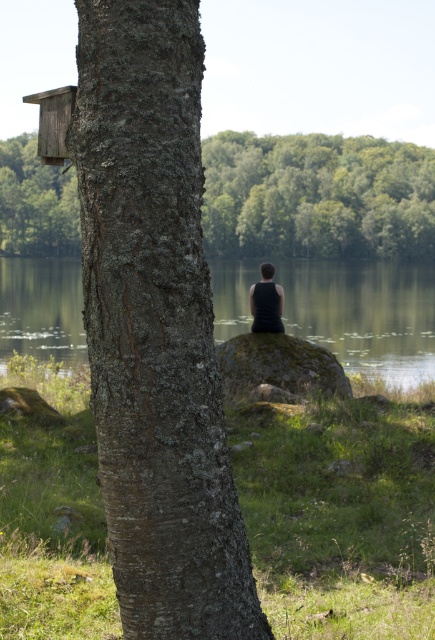
You are a photographer positioned behind the person in the scene. You want to take a photo where the green water at center is clearly visible behind the black matte tank top at center. Is the current arrangement of these objects suitable for your desired composition?

The green water at center is in front of the black matte tank top at center, so the current arrangement would not allow the water to be visible behind the tank top. You would need to adjust their positions so that the tank top is in front of the water for the desired effect.

Based on the scene description, where is the smooth bark tree trunk at center located in the image?

The smooth bark tree trunk at center is located at the 2D coordinates point (154, 326) in the image.